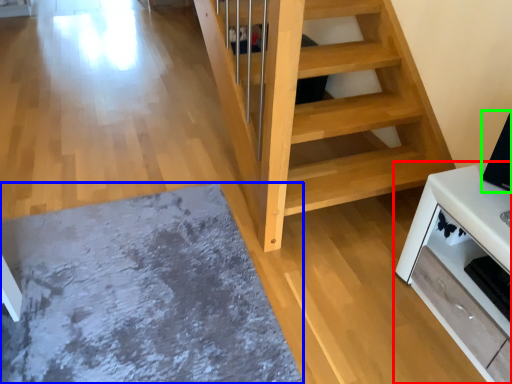
Question: Which object is the closest to the furniture (highlighted by a red box)? Choose among these: mat (highlighted by a blue box) or appliance (highlighted by a green box).

Choices:
 (A) mat
 (B) appliance

Answer: (B)